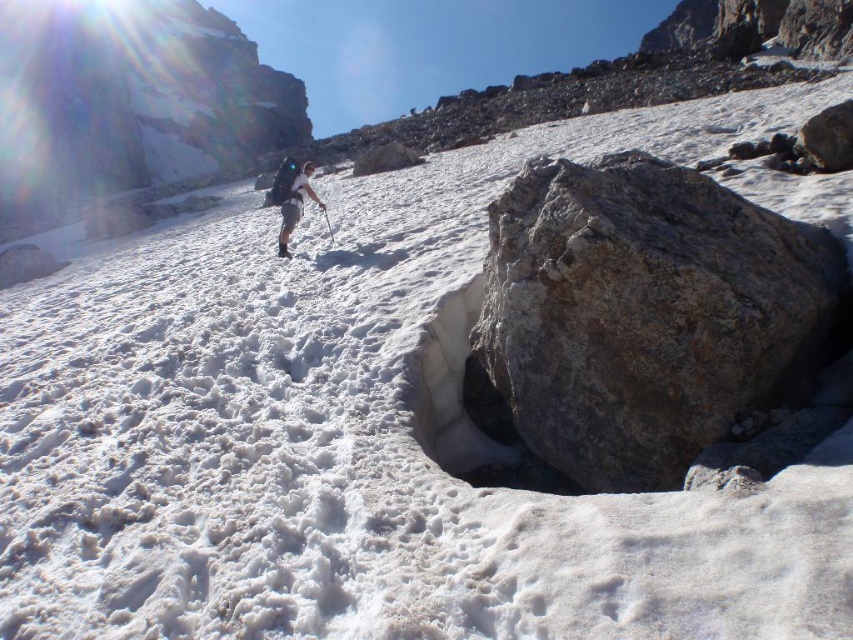
Is point (590, 403) closer to camera compared to point (303, 177)?

Yes, point (590, 403) is in front of point (303, 177).

Is gray rough rock at center thinner than light brown fabric backpack at center?

No.

Which is in front, point (720, 186) or point (300, 168)?

Point (720, 186) is more forward.

Where is `gray rough rock at center`? gray rough rock at center is located at coordinates point(645,317).